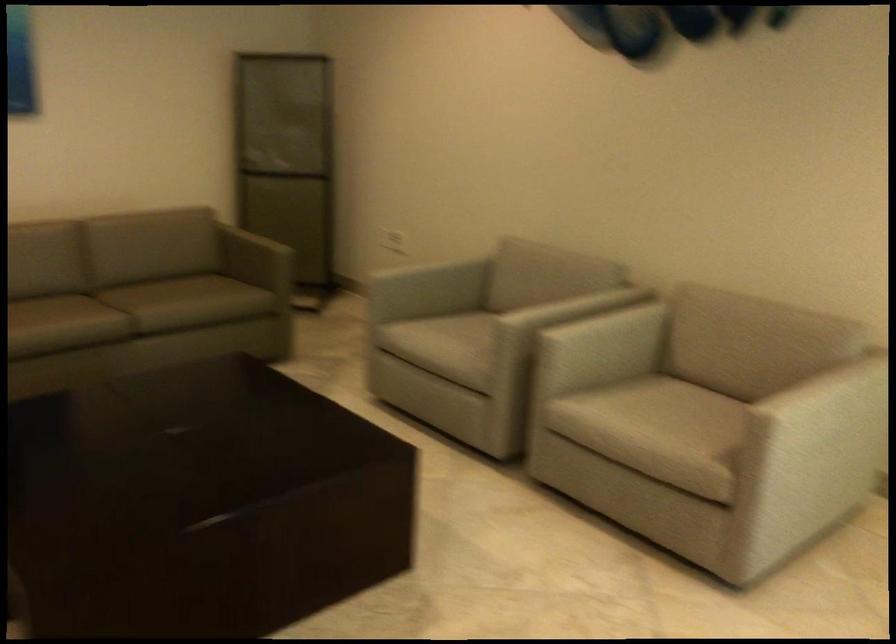
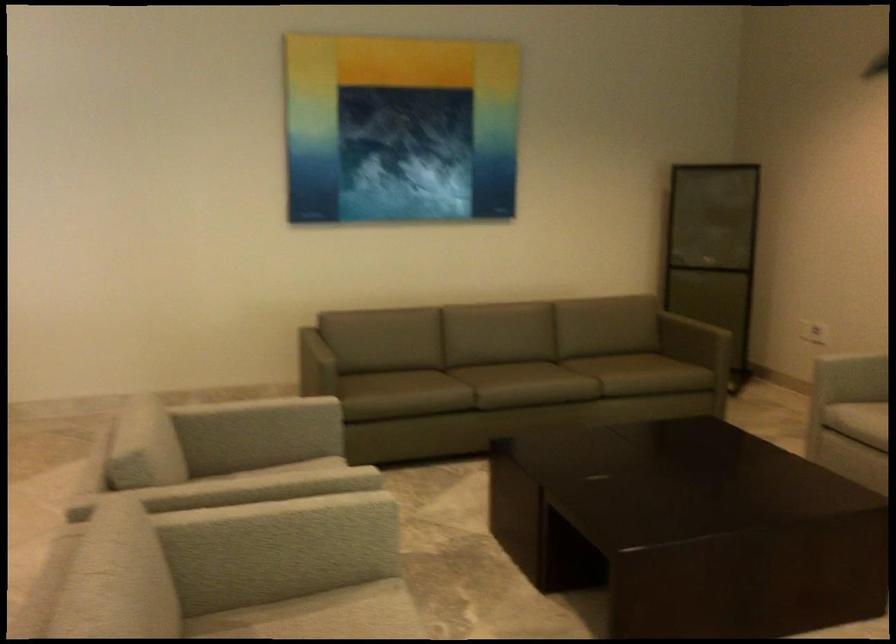
Where in the second image is the point corresponding to pixel 421 337 from the first image?

(857, 420)